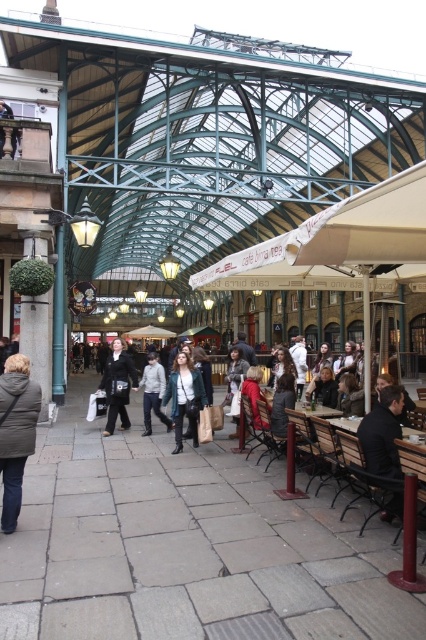
Question: Which object is positioned closest to the dark brown leather jacket at lower right?

Choices:
 (A) dark brown leather jacket at center
 (B) gray puffy coat at lower left
 (C) light gray jacket at center
 (D) denim jacket at center

Answer: (B)

Question: Does gray puffy coat at lower left have a greater width compared to denim jacket at center?

Choices:
 (A) no
 (B) yes

Answer: (A)

Question: Is gray puffy coat at lower left positioned behind denim jacket at center?

Choices:
 (A) no
 (B) yes

Answer: (A)

Question: From the image, what is the correct spatial relationship of dark brown leather jacket at lower right in relation to light gray jacket at center?

Choices:
 (A) right
 (B) left

Answer: (A)

Question: Which of the following is the closest to the observer?

Choices:
 (A) dark brown leather jacket at lower right
 (B) gray puffy coat at lower left

Answer: (A)

Question: Which of the following is the closest to the observer?

Choices:
 (A) (183, 371)
 (B) (402, 400)
 (C) (144, 432)
 (D) (22, 461)

Answer: (D)